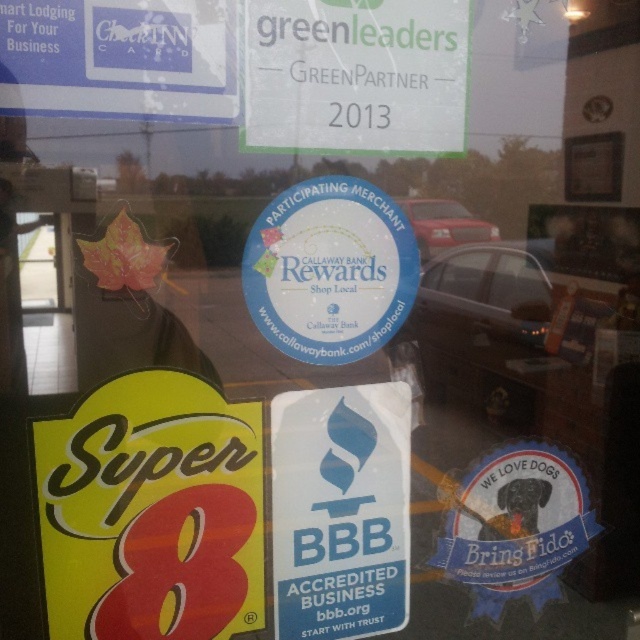
Does point (403, 532) come closer to viewer compared to point (516, 554)?

Yes, point (403, 532) is closer to viewer.

Can you confirm if white paper sticker at center is positioned above blue fabric dog at lower right?

Indeed, white paper sticker at center is positioned over blue fabric dog at lower right.

Is point (390, 593) positioned in front of point (563, 509)?

Yes, it is.

Locate an element on the screen. The width and height of the screenshot is (640, 640). white paper sticker at center is located at coordinates (340, 509).

The image size is (640, 640). Describe the element at coordinates (355, 76) in the screenshot. I see `green paper sign at upper center` at that location.

Does point (276, 19) lie behind point (484, 518)?

No.

From the picture: Who is more forward, (355, 74) or (572, 493)?

Positioned in front is point (355, 74).

At what (x,y) coordinates should I click in order to perform the action: click on green paper sign at upper center. Please return your answer as a coordinate pair (x, y). Looking at the image, I should click on (355, 76).

Is white paper sticker at center positioned at the back of white paper sign at upper left?

Yes, it is behind white paper sign at upper left.

Is white paper sticker at center above white paper sign at upper left?

No.

The image size is (640, 640). Describe the element at coordinates (340, 509) in the screenshot. I see `white paper sticker at center` at that location.

This screenshot has height=640, width=640. Find the location of `white paper sticker at center`. white paper sticker at center is located at coordinates (340, 509).